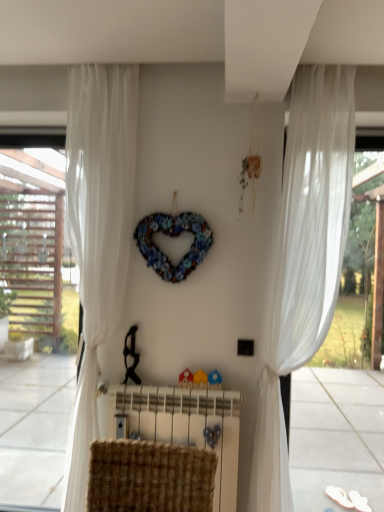
Question: From a real-world perspective, is woven fabric radiator at center beneath multicolored fabric heart at center?

Choices:
 (A) yes
 (B) no

Answer: (A)

Question: Is woven fabric radiator at center not close to multicolored fabric heart at center?

Choices:
 (A) no
 (B) yes

Answer: (A)

Question: From the image's perspective, is woven fabric radiator at center beneath multicolored fabric heart at center?

Choices:
 (A) yes
 (B) no

Answer: (A)

Question: Is woven fabric radiator at center positioned with its back to multicolored fabric heart at center?

Choices:
 (A) yes
 (B) no

Answer: (B)

Question: Does woven fabric radiator at center have a smaller size compared to multicolored fabric heart at center?

Choices:
 (A) no
 (B) yes

Answer: (A)

Question: Is white sheer curtain at left, positioned as the second curtain in right-to-left order, inside the boundaries of woven fabric radiator at center, or outside?

Choices:
 (A) inside
 (B) outside

Answer: (B)

Question: From a real-world perspective, is white sheer curtain at left, which is the 1th curtain in left-to-right order, physically located above or below woven fabric radiator at center?

Choices:
 (A) above
 (B) below

Answer: (A)

Question: From their relative heights in the image, would you say white sheer curtain at left, which is the 1th curtain in left-to-right order, is taller or shorter than woven fabric radiator at center?

Choices:
 (A) short
 (B) tall

Answer: (B)

Question: Considering the positions of white sheer curtain at left, positioned as the second curtain in right-to-left order, and woven fabric radiator at center in the image, is white sheer curtain at left, positioned as the second curtain in right-to-left order, bigger or smaller than woven fabric radiator at center?

Choices:
 (A) small
 (B) big

Answer: (B)

Question: Do you think multicolored fabric heart at center is within white sheer curtain at right, which is the 2th curtain in left-to-right order, or outside of it?

Choices:
 (A) outside
 (B) inside

Answer: (A)

Question: Considering the positions of multicolored fabric heart at center and white sheer curtain at right, the first curtain when ordered from right to left, in the image, is multicolored fabric heart at center bigger or smaller than white sheer curtain at right, the first curtain when ordered from right to left,?

Choices:
 (A) big
 (B) small

Answer: (B)

Question: From a real-world perspective, is multicolored fabric heart at center physically located above or below white sheer curtain at right, the first curtain when ordered from right to left?

Choices:
 (A) above
 (B) below

Answer: (A)

Question: In terms of width, does multicolored fabric heart at center look wider or thinner when compared to white sheer curtain at right, which is the 2th curtain in left-to-right order?

Choices:
 (A) wide
 (B) thin

Answer: (B)

Question: Considering the positions of white sheer curtain at right, which is the 2th curtain in left-to-right order, and white sheer curtain at right in the image, is white sheer curtain at right, which is the 2th curtain in left-to-right order, bigger or smaller than white sheer curtain at right?

Choices:
 (A) small
 (B) big

Answer: (A)

Question: Is white sheer curtain at right, the first curtain when ordered from right to left, situated inside white sheer curtain at right or outside?

Choices:
 (A) outside
 (B) inside

Answer: (A)